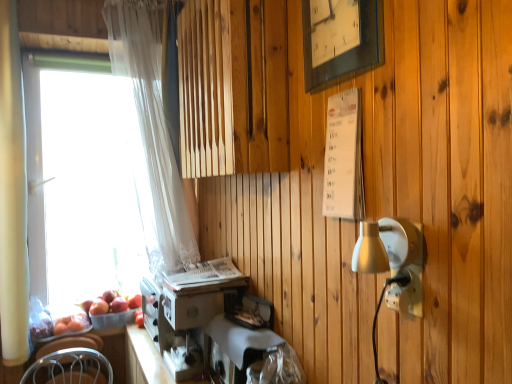
Question: Is white sheer curtain at left, the 1th curtain viewed from the back, in front of white fabric-covered sewing machine at lower center?

Choices:
 (A) yes
 (B) no

Answer: (B)

Question: Is white sheer curtain at left, the 1th curtain viewed from the back, aimed at white fabric-covered sewing machine at lower center?

Choices:
 (A) no
 (B) yes

Answer: (B)

Question: Is white sheer curtain at left, the second curtain when ordered from front to back, to the left of white fabric-covered sewing machine at lower center from the viewer's perspective?

Choices:
 (A) yes
 (B) no

Answer: (A)

Question: Can you confirm if white sheer curtain at left, the second curtain positioned from the left, is taller than white fabric-covered sewing machine at lower center?

Choices:
 (A) no
 (B) yes

Answer: (B)

Question: From a real-world perspective, is white sheer curtain at left, the 1th curtain viewed from the back, physically below white fabric-covered sewing machine at lower center?

Choices:
 (A) no
 (B) yes

Answer: (A)

Question: Does point (91, 314) appear closer or farther from the camera than point (42, 114)?

Choices:
 (A) farther
 (B) closer

Answer: (B)

Question: In the image, is red matte apple at lower left, the 2th apple positioned from the right, on the left side or the right side of transparent glass window at left?

Choices:
 (A) left
 (B) right

Answer: (B)

Question: Considering the positions of red matte apple at lower left, the first apple from the left, and transparent glass window at left in the image, is red matte apple at lower left, the first apple from the left, wider or thinner than transparent glass window at left?

Choices:
 (A) wide
 (B) thin

Answer: (B)

Question: From the image's perspective, relative to transparent glass window at left, is red matte apple at lower left, the 2th apple positioned from the right, above or below?

Choices:
 (A) below
 (B) above

Answer: (A)

Question: Is white sheer curtain at left, the first curtain positioned from the right, situated inside metallic silver coffee machine at lower center or outside?

Choices:
 (A) inside
 (B) outside

Answer: (B)

Question: From the image's perspective, is white sheer curtain at left, the 1th curtain viewed from the back, located above or below metallic silver coffee machine at lower center?

Choices:
 (A) below
 (B) above

Answer: (B)

Question: Is point (111, 49) closer or farther from the camera than point (220, 269)?

Choices:
 (A) farther
 (B) closer

Answer: (A)

Question: In terms of size, does white sheer curtain at left, the second curtain when ordered from front to back, appear bigger or smaller than metallic silver coffee machine at lower center?

Choices:
 (A) big
 (B) small

Answer: (A)

Question: Is point (114, 311) positioned closer to the camera than point (93, 301)?

Choices:
 (A) closer
 (B) farther

Answer: (A)

Question: Considering the positions of red matte apple at lower left, the 1th apple positioned from the right, and red matte apple at lower left, the 2th apple positioned from the right, in the image, is red matte apple at lower left, the 1th apple positioned from the right, bigger or smaller than red matte apple at lower left, the 2th apple positioned from the right,?

Choices:
 (A) small
 (B) big

Answer: (A)